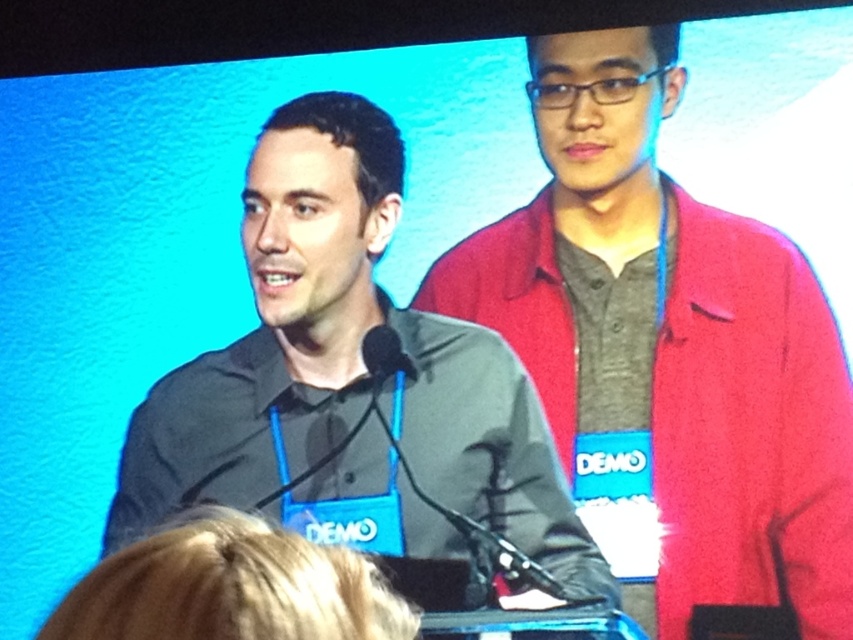
Is matte red jacket at center positioned at the back of black matte shirt at center?

No, matte red jacket at center is closer to the viewer.

The width and height of the screenshot is (853, 640). Identify the location of matte red jacket at center. (670, 352).